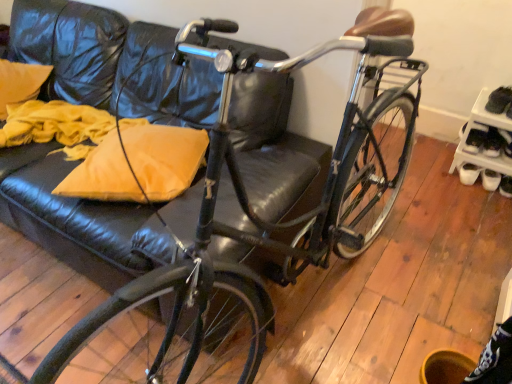
Question: Is matte yellow pillow at left at the right side of yellow fabric pillow at upper left?

Choices:
 (A) no
 (B) yes

Answer: (B)

Question: From the image's perspective, is matte yellow pillow at left on yellow fabric pillow at upper left?

Choices:
 (A) no
 (B) yes

Answer: (A)

Question: Considering the relative sizes of matte yellow pillow at left and yellow fabric pillow at upper left in the image provided, is matte yellow pillow at left wider than yellow fabric pillow at upper left?

Choices:
 (A) no
 (B) yes

Answer: (B)

Question: Is matte yellow pillow at left positioned before yellow fabric pillow at upper left?

Choices:
 (A) no
 (B) yes

Answer: (B)

Question: Could you tell me if matte yellow pillow at left is turned towards yellow fabric pillow at upper left?

Choices:
 (A) no
 (B) yes

Answer: (A)

Question: Is matte yellow pillow at left behind yellow fabric pillow at upper left?

Choices:
 (A) no
 (B) yes

Answer: (A)

Question: Does black leather shoe at right have a lesser width compared to black leather shoe at lower right?

Choices:
 (A) no
 (B) yes

Answer: (A)

Question: Is black leather shoe at right oriented towards black leather shoe at lower right?

Choices:
 (A) no
 (B) yes

Answer: (A)

Question: Considering the relative sizes of black leather shoe at right and black leather shoe at lower right in the image provided, is black leather shoe at right taller than black leather shoe at lower right?

Choices:
 (A) no
 (B) yes

Answer: (B)

Question: Is black leather shoe at right positioned in front of black leather shoe at lower right?

Choices:
 (A) yes
 (B) no

Answer: (A)

Question: Are black leather shoe at right and black leather shoe at lower right far apart?

Choices:
 (A) yes
 (B) no

Answer: (B)

Question: From the image's perspective, is black leather shoe at right located above black leather shoe at lower right?

Choices:
 (A) yes
 (B) no

Answer: (A)

Question: Is matte yellow pillow at left to the right of black leather shoe at lower right from the viewer's perspective?

Choices:
 (A) no
 (B) yes

Answer: (A)